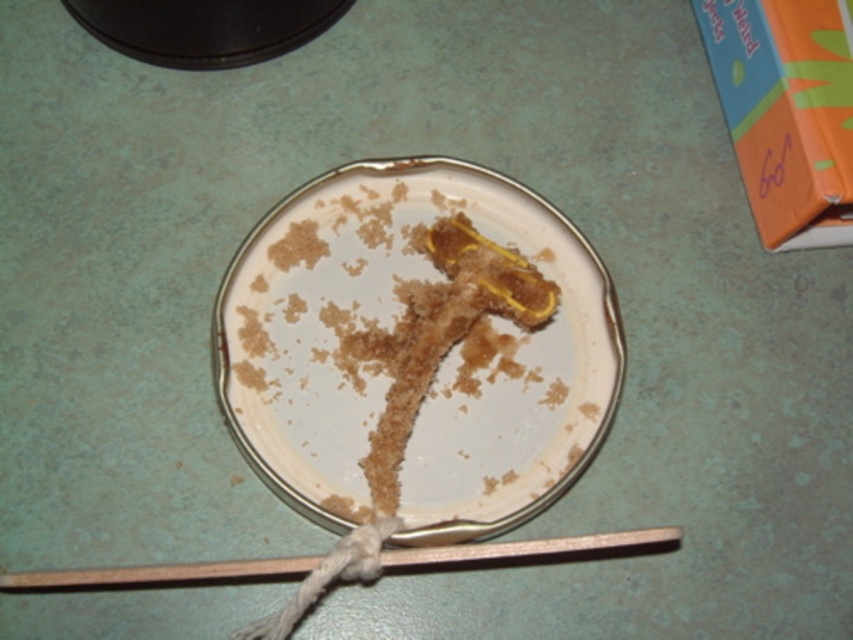
Who is positioned more to the left, white glossy plate at center or wooden chopstick at lower center?

Positioned to the left is wooden chopstick at lower center.

What do you see at coordinates (399, 348) in the screenshot? I see `white glossy plate at center` at bounding box center [399, 348].

Which is in front, point (425, 452) or point (151, 572)?

Positioned in front is point (151, 572).

At what (x,y) coordinates should I click in order to perform the action: click on white glossy plate at center. Please return your answer as a coordinate pair (x, y). This screenshot has width=853, height=640. Looking at the image, I should click on (399, 348).